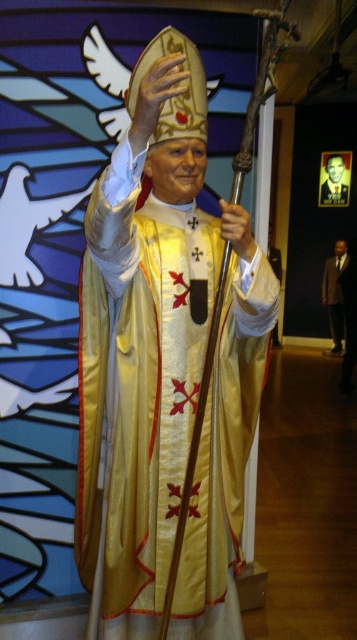
You are a photographer setting up for a group photo. You need to position the dark brown suit at right and the gold textured robe at center so that they are exactly 40 inches apart. Based on their current positions, do you need to move them closer together or farther apart?

The dark brown suit at right is currently 38.69 inches from the gold textured robe at center. Since 38.69 inches is less than 40 inches, you need to move them farther apart to reach the desired distance of 40 inches.